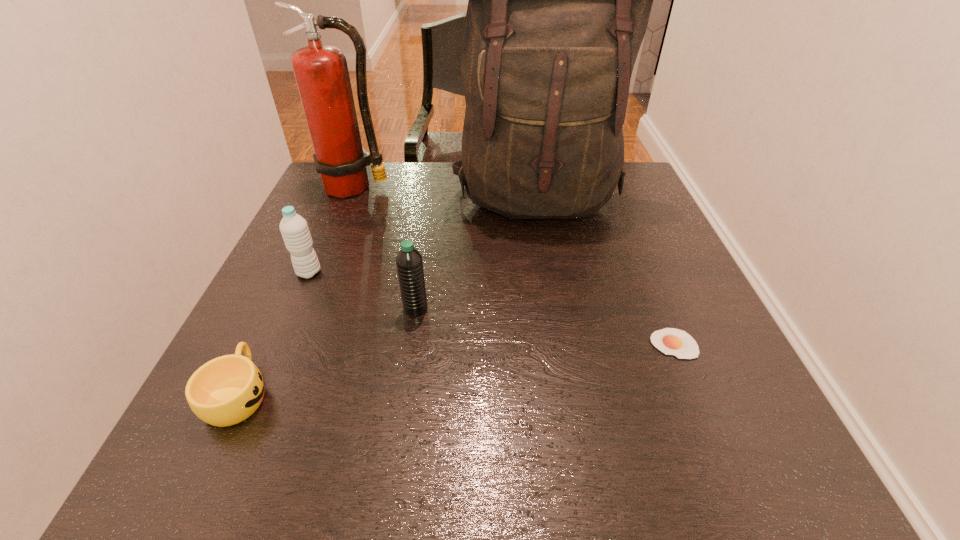
The image size is (960, 540). What are the coordinates of `free region at the right edge` in the screenshot? It's located at (648, 227).

What are the coordinates of `free space at the near left corner` in the screenshot? It's located at (266, 437).

The image size is (960, 540). Find the location of `vacant space at the far right corner of the desktop`. vacant space at the far right corner of the desktop is located at coordinates (610, 202).

In order to click on free area in between the shortest object and the right water bottle in this screenshot , I will do `click(544, 326)`.

Find the location of a particular element. Image resolution: width=960 pixels, height=540 pixels. free area in between the tallest object and the fire extinguisher is located at coordinates (446, 193).

What are the coordinates of `empty space between the fire extinguisher and the tallest object` in the screenshot? It's located at (446, 193).

The width and height of the screenshot is (960, 540). Identify the location of vacant area that lies between the cup and the egg yolk. (456, 369).

This screenshot has height=540, width=960. Find the location of `vacant point located between the nearest object and the farther water bottle`. vacant point located between the nearest object and the farther water bottle is located at coordinates (274, 333).

What are the coordinates of `vacant region between the fifth shortest object and the shortest object` in the screenshot? It's located at (515, 266).

At what (x,y) coordinates should I click in order to perform the action: click on free space between the shortest object and the backpack. Please return your answer as a coordinate pair (x, y). Looking at the image, I should click on (606, 272).